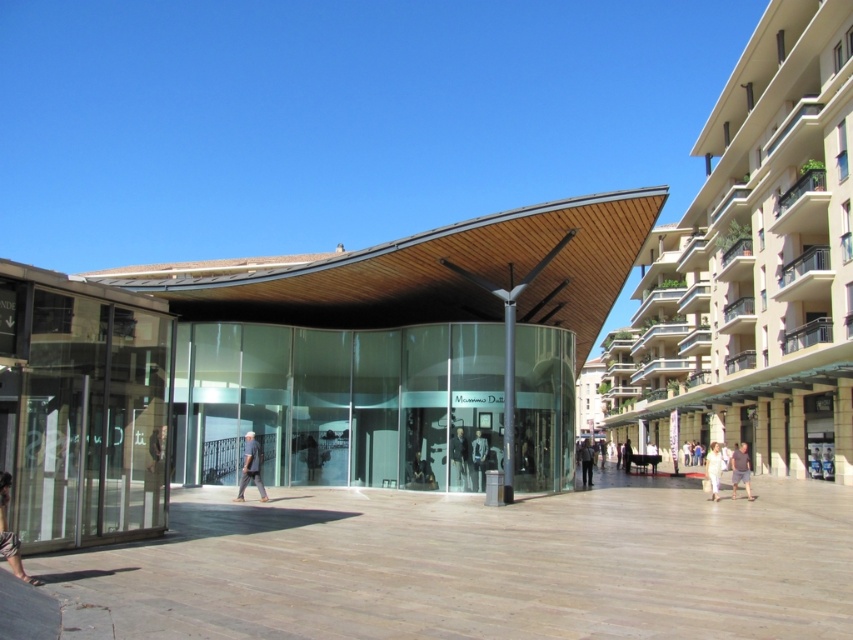
You are standing in front of the modern architectural structure and see a light blue jeans at center and a white fabric person at center. Which object is smaller in size?

The light blue jeans at center is smaller in size compared to the white fabric person at center.

You are standing at the entrance of the shopping center and want to find the dark gray fabric mannequin at center. According to the coordinates provided, in which direction should you look to locate it?

The dark gray fabric mannequin at center is located at coordinates point [479,460], which is to the right and slightly above the center of the image. So you should look towards the right side and a bit upwards from the center point to find it.

You are standing at the entrance of the shopping center and see both the light brown leather shoes at lower left and the light brown leather jacket at center. Which item appears narrower when viewed from your position?

The light brown leather shoes at lower left appear narrower than the light brown leather jacket at center because the shoes are thinner than the jacket.